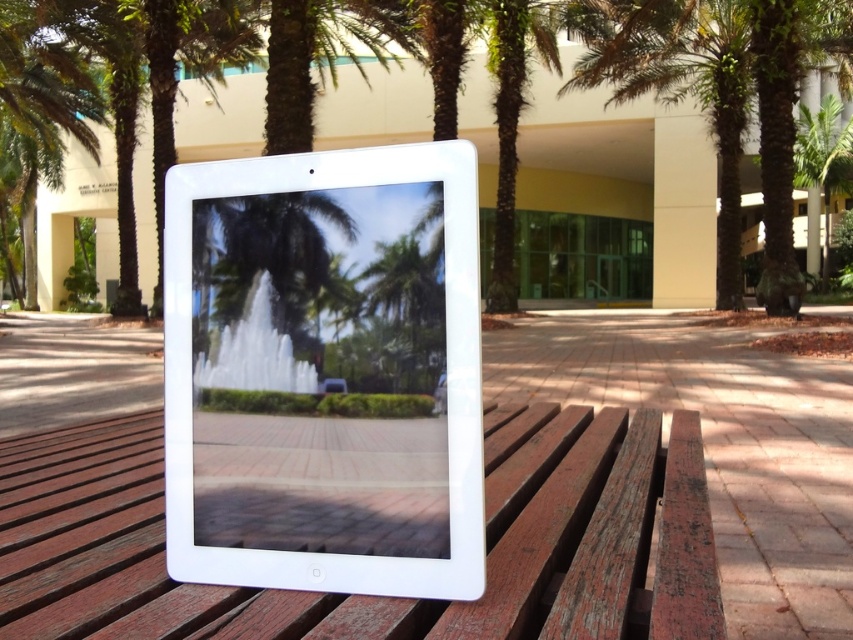
Question: Does white glossy tablet at center appear over wooden picnic table at center?

Choices:
 (A) yes
 (B) no

Answer: (A)

Question: Which object is farther from the camera taking this photo?

Choices:
 (A) wooden picnic table at center
 (B) white glossy tablet at center

Answer: (B)

Question: Which point is closer to the camera?

Choices:
 (A) green leafy palm tree at upper right
 (B) white glossy tablet at center

Answer: (B)

Question: Does white glossy tablet at center have a lesser width compared to green leafy palm tree at upper right?

Choices:
 (A) no
 (B) yes

Answer: (B)

Question: Which object is the farthest from the white glossy tablet at center?

Choices:
 (A) wooden picnic table at center
 (B) green leafy palm tree at upper right

Answer: (B)

Question: Does white glossy tablet at center appear on the left side of wooden picnic table at center?

Choices:
 (A) yes
 (B) no

Answer: (B)